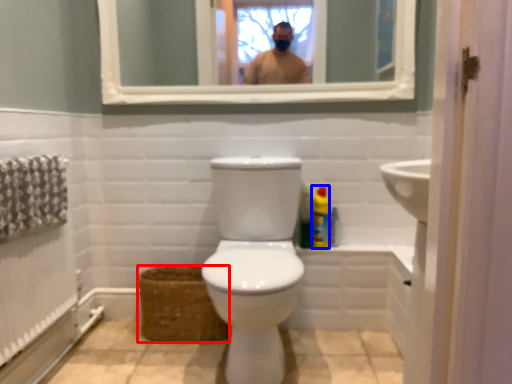
Question: Among these objects, which one is nearest to the camera, basket (highlighted by a red box) or cleaning product (highlighted by a blue box)?

Choices:
 (A) basket
 (B) cleaning product

Answer: (A)